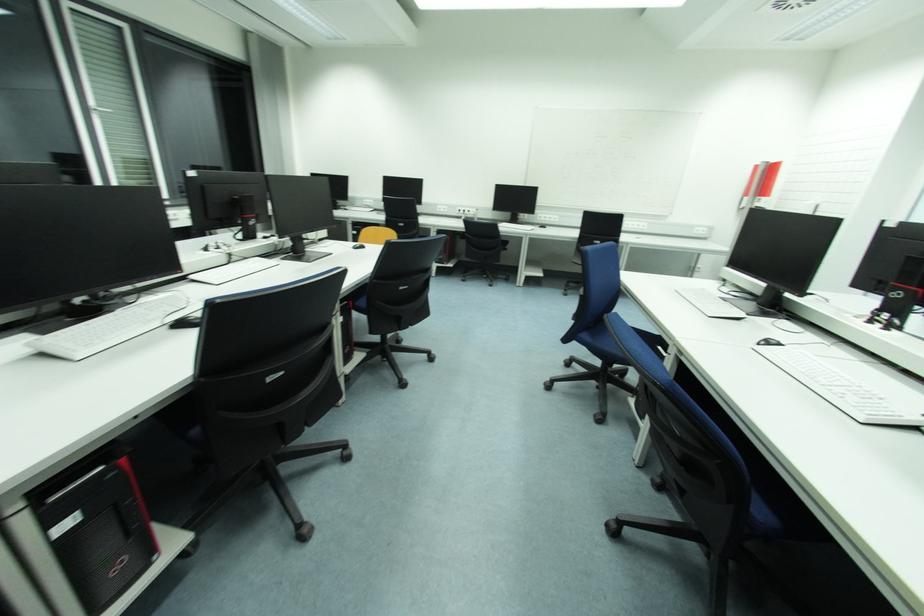
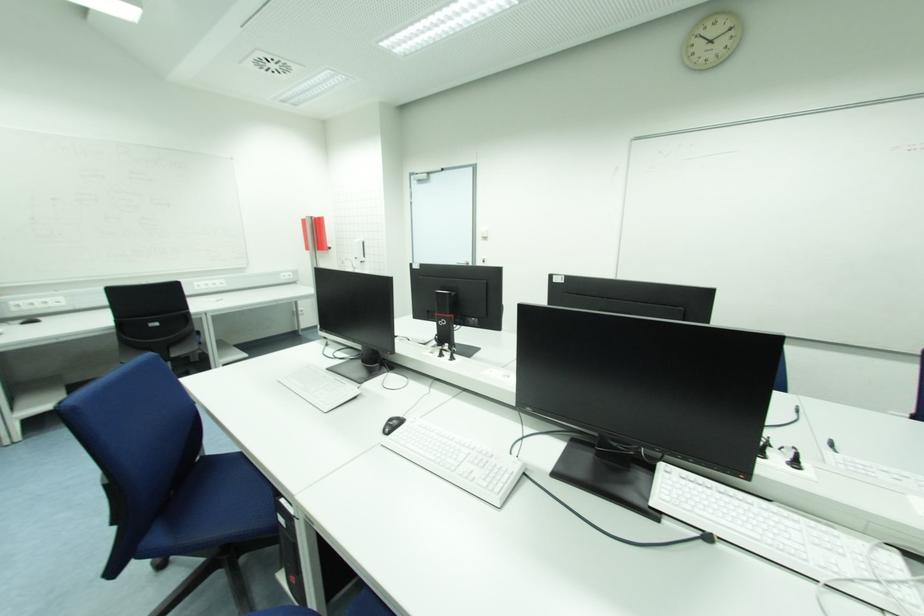
Locate, in the second image, the point that corresponds to point (773, 344) in the first image.

(395, 426)